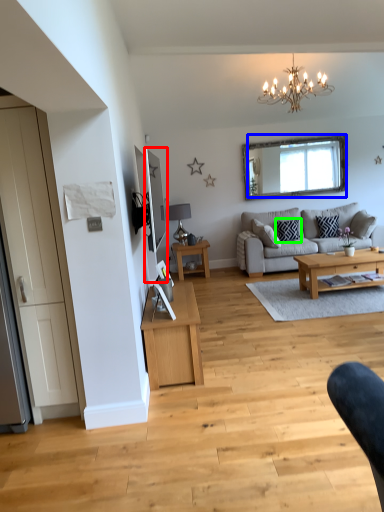
Question: Which object is the farthest from mirror (highlighted by a red box)? Choose among these: mirror (highlighted by a blue box) or pillow (highlighted by a green box).

Choices:
 (A) mirror
 (B) pillow

Answer: (B)